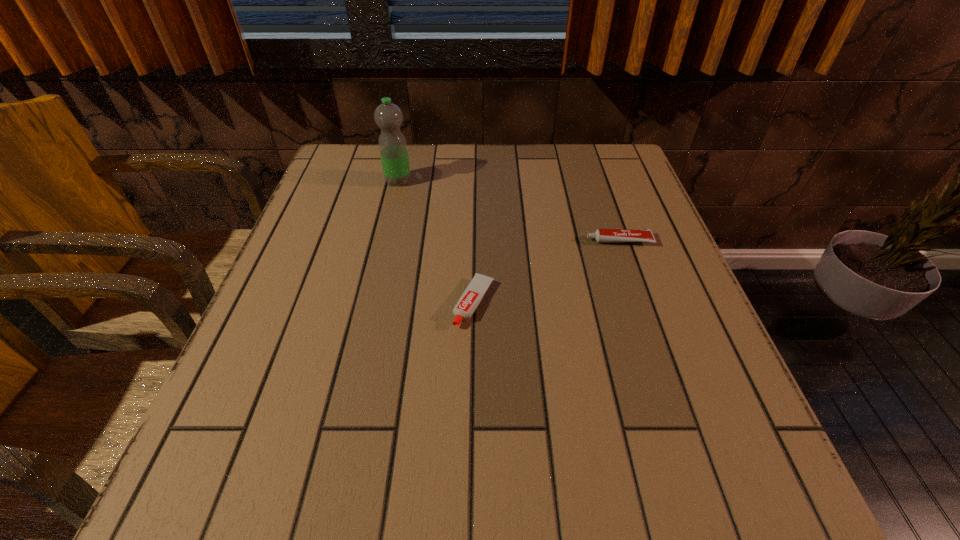
The width and height of the screenshot is (960, 540). I want to click on vacant area located on the left of the nearest object, so click(362, 303).

Identify the location of object that is positioned at the far edge. (388, 116).

The height and width of the screenshot is (540, 960). I want to click on object that is at the right edge, so click(x=601, y=235).

The height and width of the screenshot is (540, 960). What are the coordinates of `vacant space at the far edge of the desktop` in the screenshot? It's located at click(x=508, y=145).

Locate an element on the screen. free space at the near edge of the desktop is located at coordinates click(x=391, y=461).

Locate an element on the screen. blank space at the left edge of the desktop is located at coordinates (323, 260).

In the image, there is a desktop. Where is `vacant space at the right edge`? The image size is (960, 540). vacant space at the right edge is located at coordinates click(624, 226).

Where is `vacant area at the far left corner of the desktop`? vacant area at the far left corner of the desktop is located at coordinates (342, 162).

Find the location of a particular element. free spot at the far right corner of the desktop is located at coordinates (595, 184).

Locate an element on the screen. free point between the second object from left to right and the tallest object is located at coordinates (436, 242).